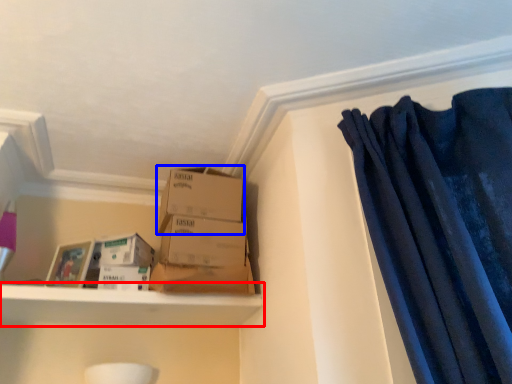
Question: Which point is closer to the camera, shelf (highlighted by a red box) or box (highlighted by a blue box)?

Choices:
 (A) shelf
 (B) box

Answer: (A)